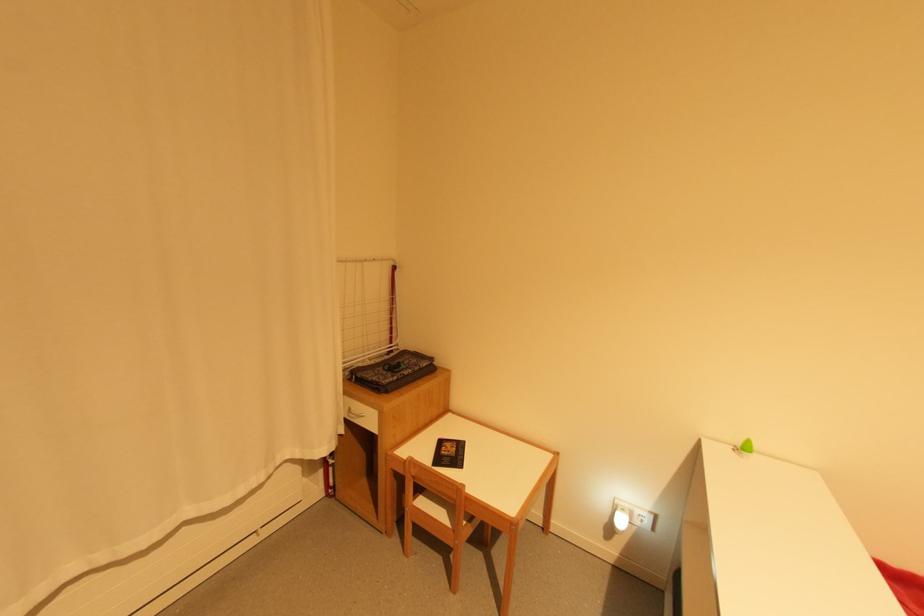
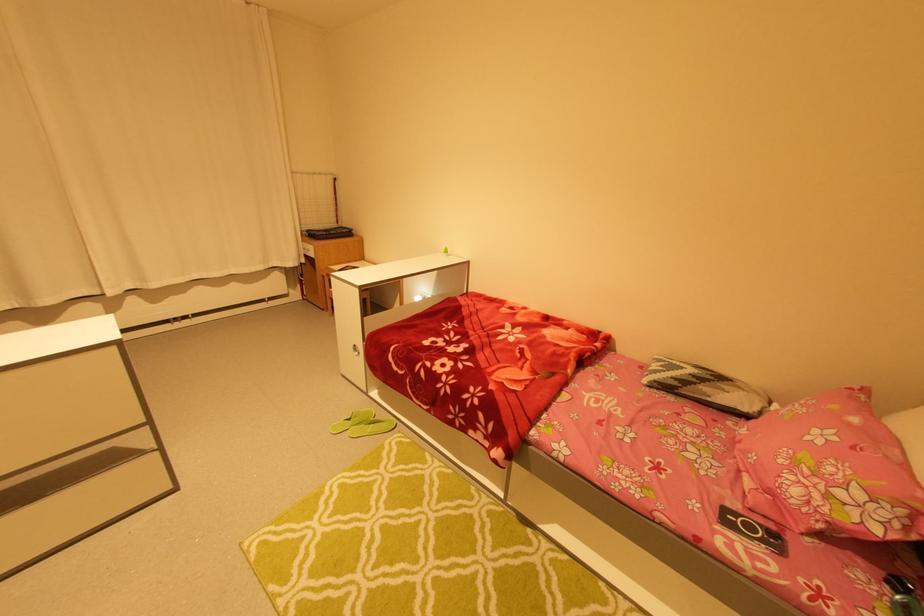
In the scene shown: In a continuous first-person perspective shot, in which direction is the camera moving?

The cameraman walked toward right, backward.